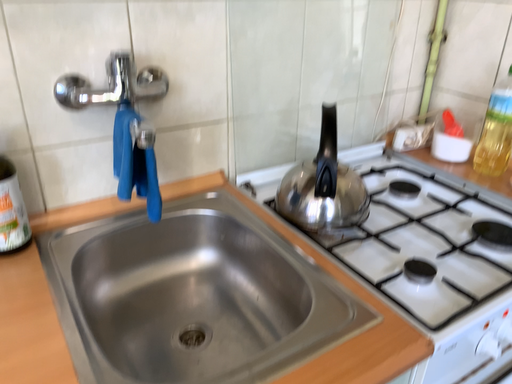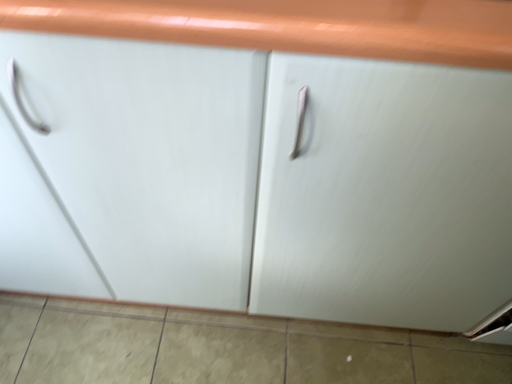
Question: Which way did the camera rotate in the video?

Choices:
 (A) rotated upward
 (B) rotated downward

Answer: (B)